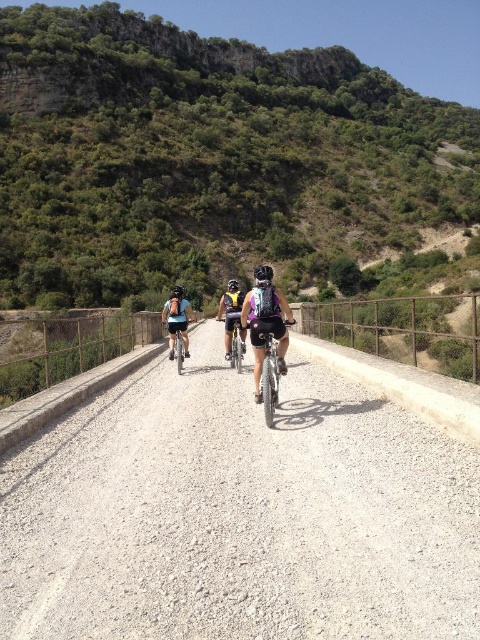
Question: Among these points, which one is farthest from the camera?

Choices:
 (A) (271, 275)
 (B) (173, 339)

Answer: (B)

Question: Which object is the farthest from the matte black helmet at center?

Choices:
 (A) shiny silver bicycle at center
 (B) matte purple bicycle at center

Answer: (A)

Question: Is matte purple backpack at center wider than black matte bicycle helmet at center?

Choices:
 (A) yes
 (B) no

Answer: (B)

Question: Which object is closer to the camera taking this photo?

Choices:
 (A) black matte helmet at center
 (B) black matte bicycle helmet at center
 (C) metallic silver bicycle at center

Answer: (C)

Question: Is black matte bicycle helmet at center below black matte helmet at center?

Choices:
 (A) no
 (B) yes

Answer: (A)

Question: Does shiny silver bicycle at center have a lesser width compared to matte black helmet at center?

Choices:
 (A) yes
 (B) no

Answer: (A)